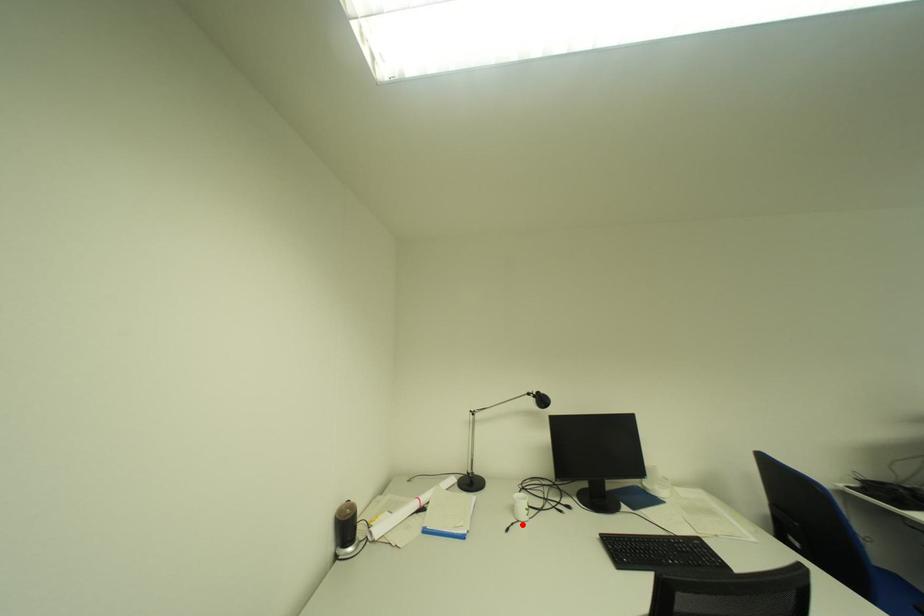
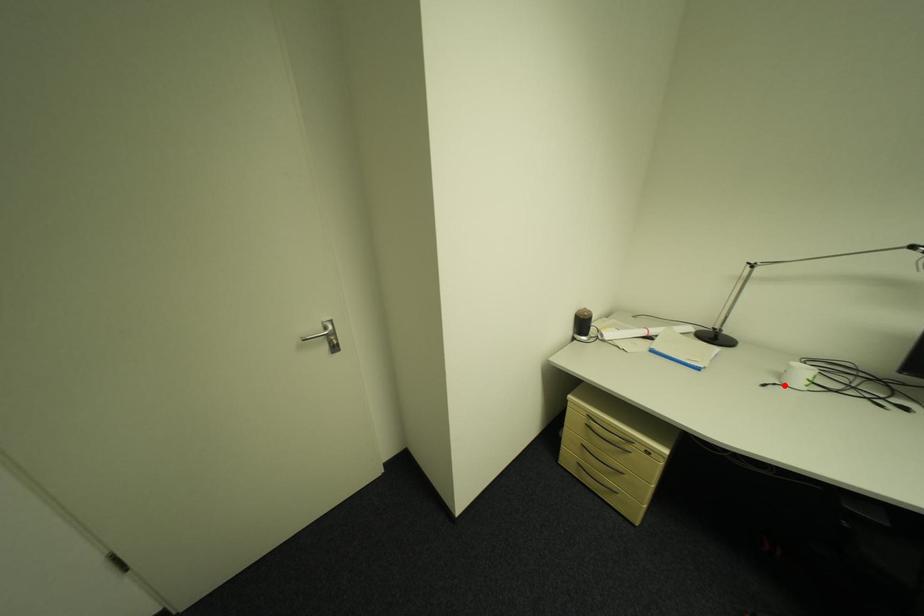
I am providing you with two images of the same scene from different viewpoints. A red point is marked on the first image and another point is marked on the second image. Is the marked point in image1 the same physical position as the marked point in image2?

Yes